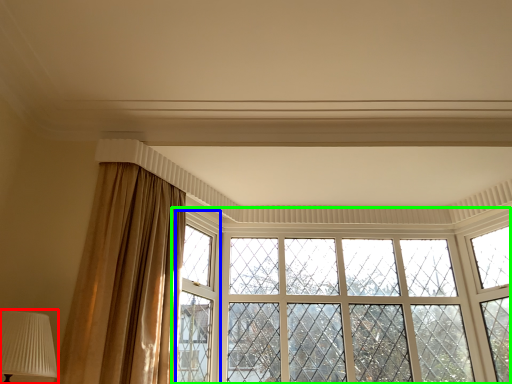
Question: Estimate the real-world distances between objects in this image. Which object is farther from table lamp (highlighted by a red box), window frame (highlighted by a blue box) or window (highlighted by a green box)?

Choices:
 (A) window frame
 (B) window

Answer: (B)